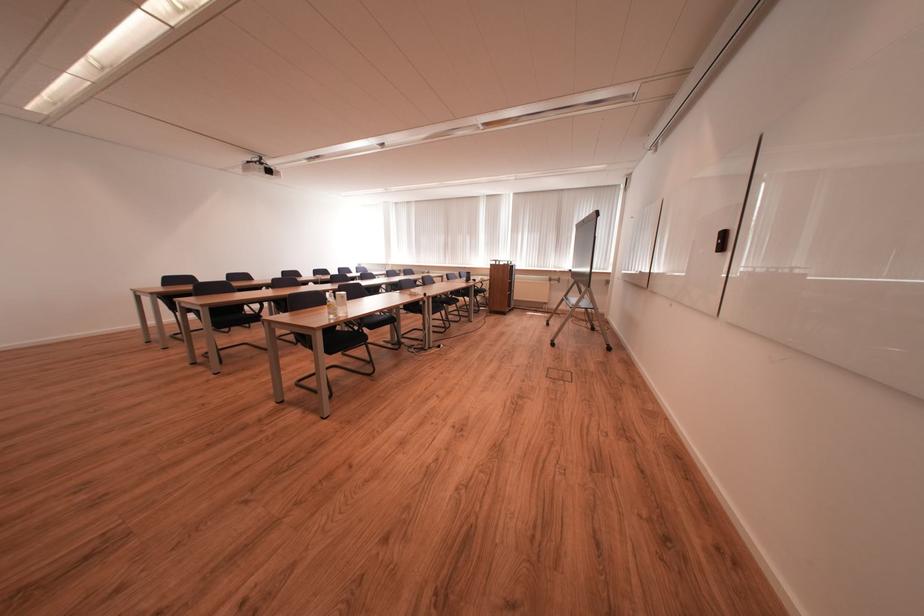
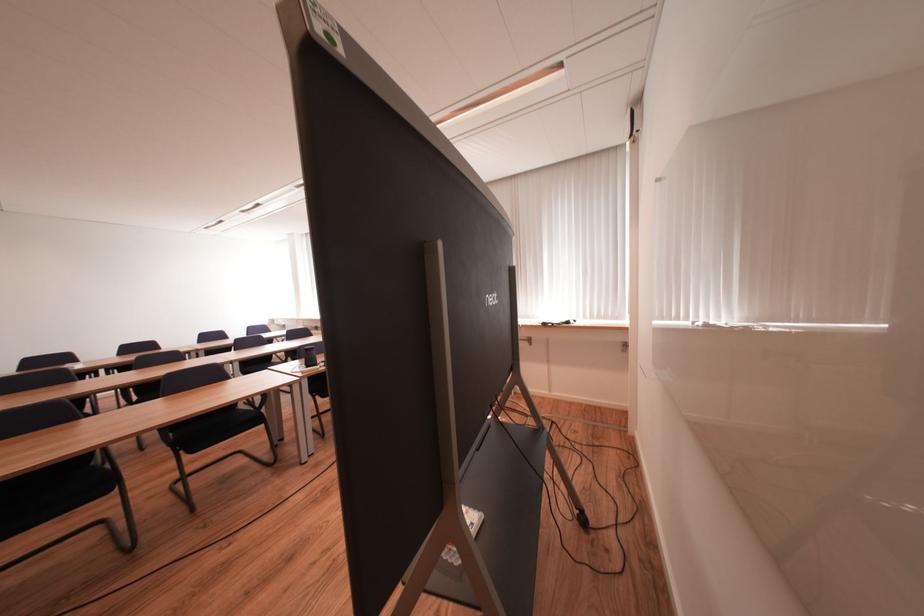
Question: I am providing you with two images of the same scene from different viewpoints. Please identify which objects are invisible in image2.

Choices:
 (A) wooden lectern
 (B) white lidded container
 (C) black chair sitting surface
 (D) small black speaker

Answer: (A)